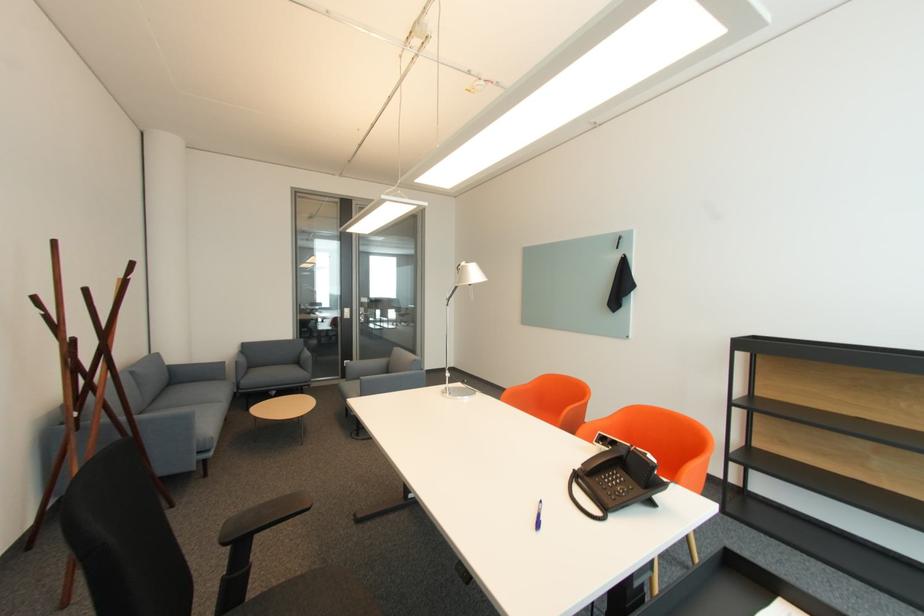
Find the location of a particular element. The height and width of the screenshot is (616, 924). black chair armrest is located at coordinates (262, 517).